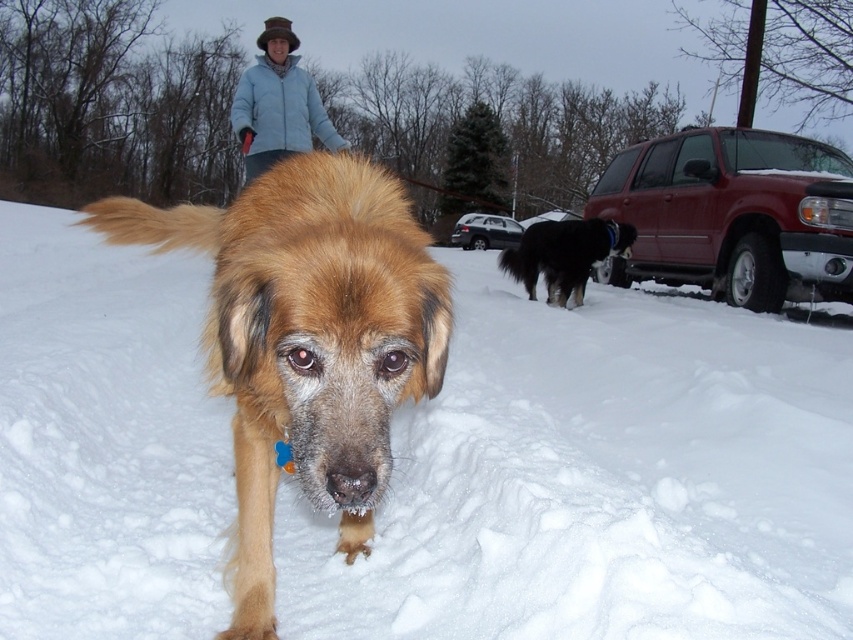
Is golden fur dog at center wider than light blue fabric at upper center?

Yes, golden fur dog at center is wider than light blue fabric at upper center.

Is point (352, 198) positioned before point (252, 177)?

That is True.

This screenshot has width=853, height=640. Find the location of `golden fur dog at center`. golden fur dog at center is located at coordinates (306, 340).

Where is `golden fur dog at center`? Image resolution: width=853 pixels, height=640 pixels. golden fur dog at center is located at coordinates (306, 340).

Which is above, light blue fabric at upper center or black shaggy dog at right?

light blue fabric at upper center

Between light blue fabric at upper center and black shaggy dog at right, which one appears on the left side from the viewer's perspective?

light blue fabric at upper center is more to the left.

The image size is (853, 640). Find the location of `light blue fabric at upper center`. light blue fabric at upper center is located at coordinates (277, 104).

Which is in front, point (816, 540) or point (579, 250)?

Point (816, 540) is in front.

Is white fluffy snow at center positioned before black shaggy dog at right?

Yes.

Is point (280, 525) in front of point (546, 259)?

That is True.

Locate an element on the screen. The image size is (853, 640). white fluffy snow at center is located at coordinates (601, 481).